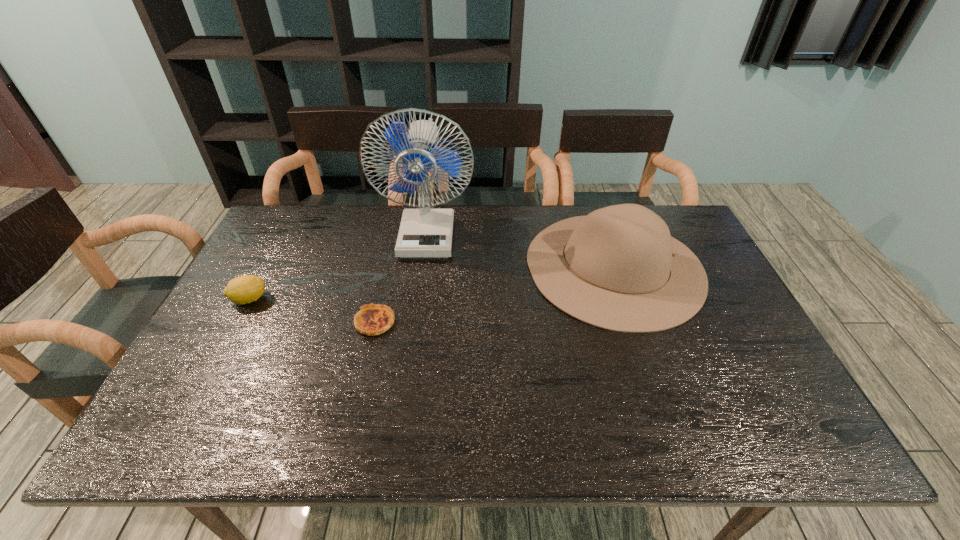
Where is `the second closest object to the tallest object`? the second closest object to the tallest object is located at coordinates (373, 319).

Identify which object is the closest to the rightmost object. Please provide its 2D coordinates. Your answer should be formatted as a tuple, i.e. [(x, y)], where the tuple contains the x and y coordinates of a point satisfying the conditions above.

[(426, 232)]

The image size is (960, 540). What are the coordinates of `vacant space that satisfies the following two spatial constraints: 1. on the front-facing side of the rightmost object; 2. on the left side of the tallest object` in the screenshot? It's located at (422, 267).

Find the location of a particular element. The width and height of the screenshot is (960, 540). vacant space that satisfies the following two spatial constraints: 1. at the stem end of the third tallest object; 2. on the left side of the quiche is located at coordinates (237, 322).

At what (x,y) coordinates should I click in order to perform the action: click on free region that satisfies the following two spatial constraints: 1. on the back side of the third shortest object; 2. on the left side of the quiche. Please return your answer as a coordinate pair (x, y). Looking at the image, I should click on (388, 267).

The image size is (960, 540). Identify the location of blank area in the image that satisfies the following two spatial constraints: 1. on the back side of the rightmost object; 2. on the right side of the quiche. (388, 267).